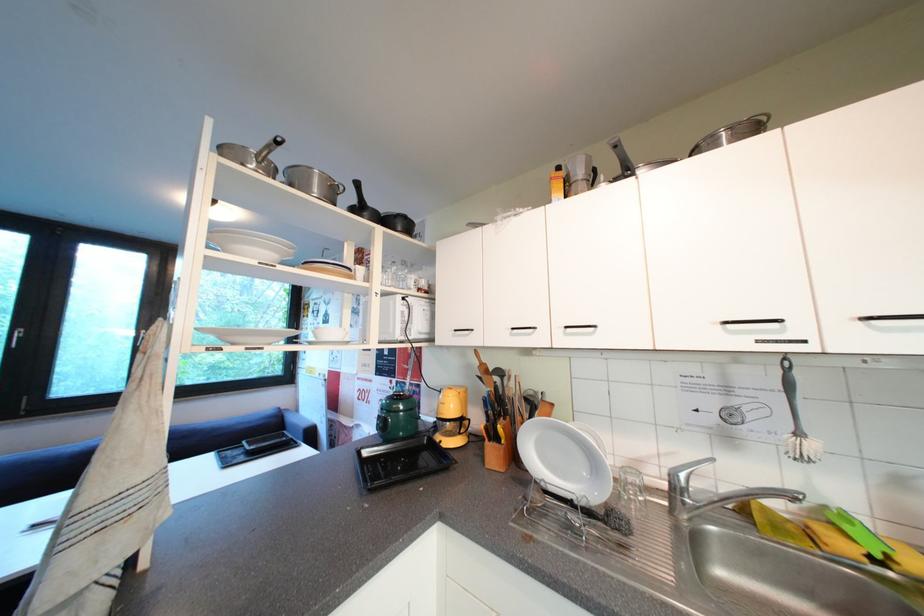
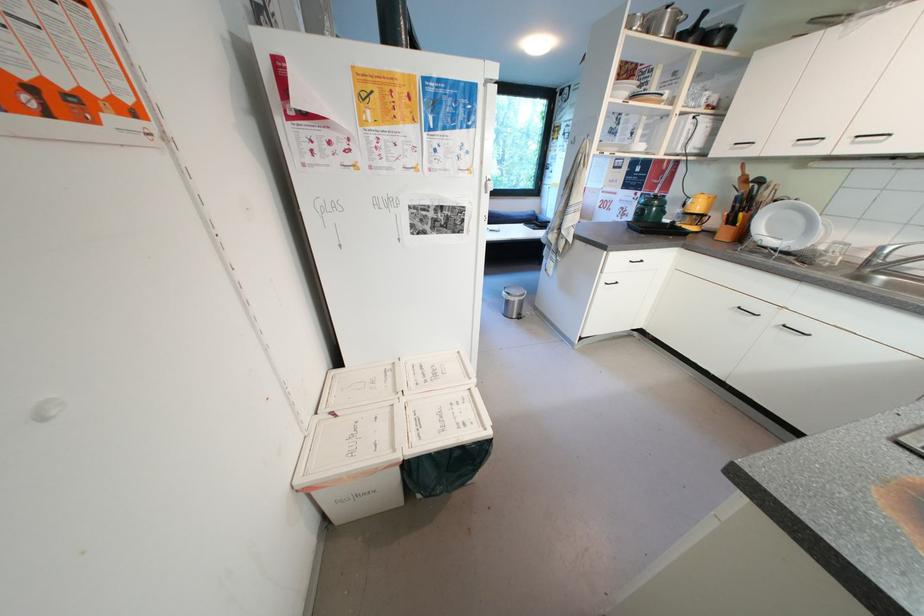
Find the pixel in the second image that matches point (684, 490) in the first image.

(883, 257)